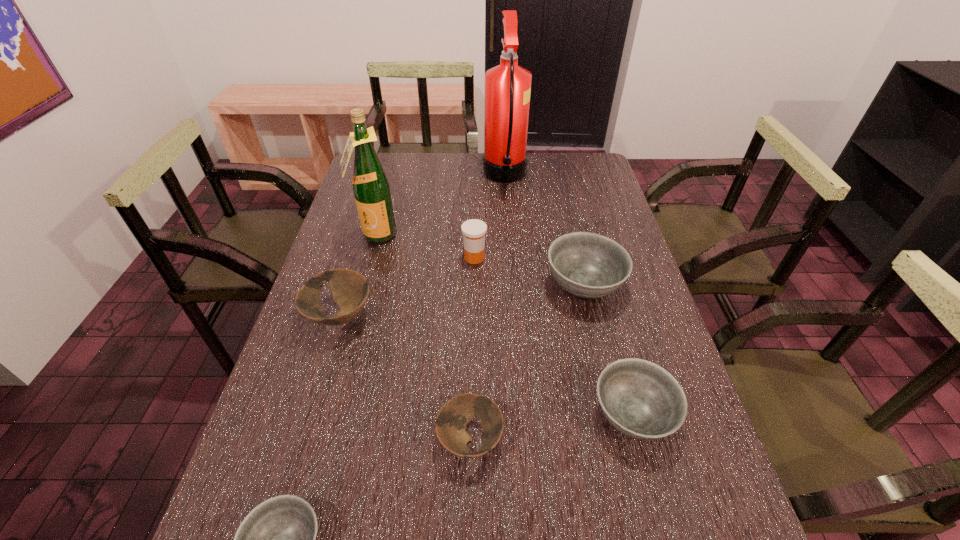
This screenshot has width=960, height=540. Identify the location of vacant space in between the third bowl from left to right and the second farthest gray bowl. (551, 428).

Image resolution: width=960 pixels, height=540 pixels. Identify the location of vacant area between the medicine and the seventh shortest object. (425, 246).

Where is `free space between the tallest object and the biggest gray bowl`? The width and height of the screenshot is (960, 540). free space between the tallest object and the biggest gray bowl is located at coordinates (544, 231).

Identify which object is located as the third nearest to the left brown bowl. Please provide its 2D coordinates. Your answer should be formatted as a tuple, i.e. [(x, y)], where the tuple contains the x and y coordinates of a point satisfying the conditions above.

[(455, 414)]

Select which object appears as the fourth closest to the farthest object. Please provide its 2D coordinates. Your answer should be formatted as a tuple, i.e. [(x, y)], where the tuple contains the x and y coordinates of a point satisfying the conditions above.

[(350, 290)]

The image size is (960, 540). Identify the location of bowl that is the closest one to the bigger brown bowl. (455, 414).

Identify which bowl is located as the fourth nearest to the red fire extinguisher. Please provide its 2D coordinates. Your answer should be formatted as a tuple, i.e. [(x, y)], where the tuple contains the x and y coordinates of a point satisfying the conditions above.

[(455, 414)]

This screenshot has height=540, width=960. Identify the location of gray bowl that stands as the third closest to the bigger brown bowl. (640, 399).

Identify the location of gray bowl that is the second closest to the second nearest gray bowl. This screenshot has width=960, height=540. (277, 539).

Where is `free spot that satisfies the following two spatial constraints: 1. at the spray nozzle of the second farthest gray bowl; 2. on the left side of the farthest object`? free spot that satisfies the following two spatial constraints: 1. at the spray nozzle of the second farthest gray bowl; 2. on the left side of the farthest object is located at coordinates (523, 416).